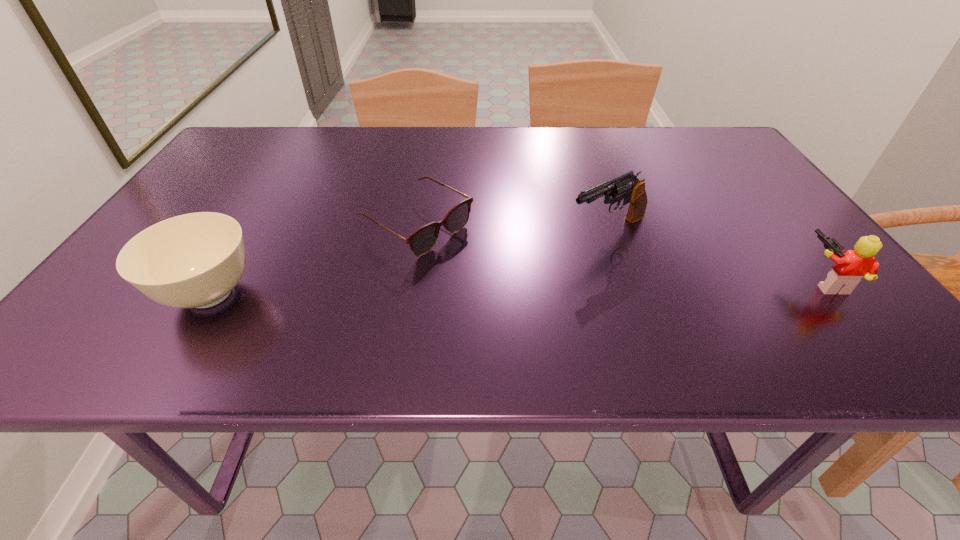
Image resolution: width=960 pixels, height=540 pixels. What are the coordinates of `object present at the near right corner` in the screenshot? It's located at (849, 268).

The height and width of the screenshot is (540, 960). In the image, there is a desktop. Find the location of `vacant space at the far edge`. vacant space at the far edge is located at coordinates pos(655,126).

I want to click on free space at the near edge of the desktop, so click(x=285, y=306).

You are a GUI agent. You are given a task and a screenshot of the screen. Output one action in this format:
    pyautogui.click(x=<x>, y=<y>)
    Task: Click on the vacant space at the left edge of the desktop
    
    Given the screenshot: What is the action you would take?
    pyautogui.click(x=250, y=171)

Where is `vacant area at the right edge of the desktop`? vacant area at the right edge of the desktop is located at coordinates (780, 225).

Identify the location of vacant area at the far left corner. Image resolution: width=960 pixels, height=540 pixels. (225, 152).

In the image, there is a desktop. Find the location of `vacant region at the far right corner`. vacant region at the far right corner is located at coordinates (732, 152).

The height and width of the screenshot is (540, 960). I want to click on free space at the near right corner of the desktop, so click(807, 303).

Identify the location of free space between the rightmost object and the gun. This screenshot has height=540, width=960. (716, 256).

At what (x,y) coordinates should I click in order to perform the action: click on free space between the third object from left to right and the spectacles. Please return your answer as a coordinate pair (x, y). This screenshot has width=960, height=540. Looking at the image, I should click on (513, 229).